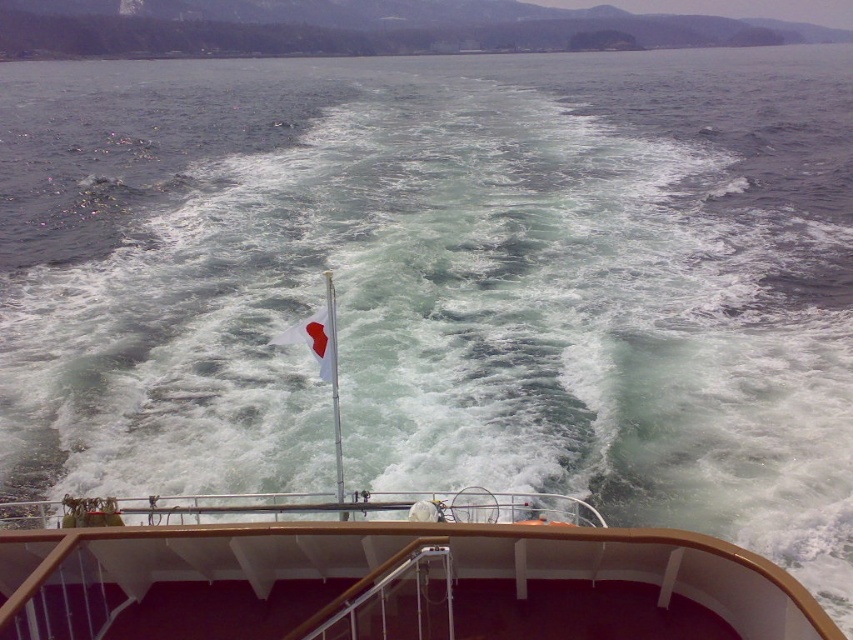
Question: Does brown polished wood deck at lower center have a larger size compared to white plastic flagpole at center?

Choices:
 (A) yes
 (B) no

Answer: (B)

Question: Which point is farther to the camera?

Choices:
 (A) (212, 541)
 (B) (303, 324)

Answer: (B)

Question: Which object is the closest to the white plastic flagpole at center?

Choices:
 (A) brown polished wood deck at lower center
 (B) white fabric flag at center

Answer: (A)

Question: Which point is farther to the camera?

Choices:
 (A) (318, 342)
 (B) (300, 614)

Answer: (A)

Question: Does white fabric flag at center come in front of white plastic flagpole at center?

Choices:
 (A) no
 (B) yes

Answer: (A)

Question: Is brown polished wood deck at lower center wider than white fabric flag at center?

Choices:
 (A) no
 (B) yes

Answer: (B)